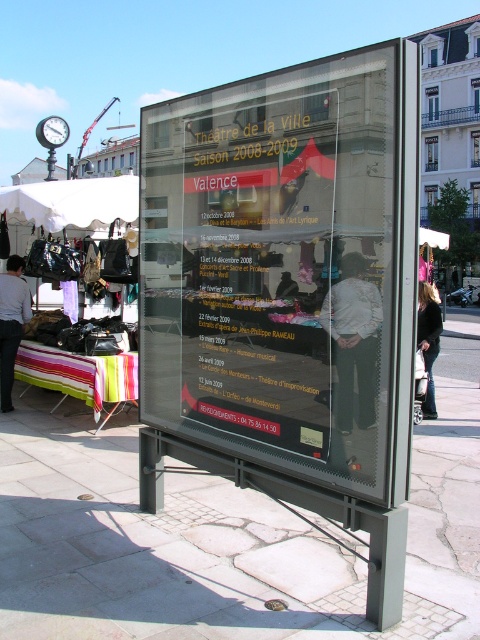
Question: Which point is closer to the camera?

Choices:
 (A) white fabric canopy at upper left
 (B) white cotton shirt at center
 (C) black leather jacket at lower right
 (D) matte black shirt at center

Answer: (B)

Question: Can you confirm if white cotton shirt at center is positioned below black leather jacket at lower right?

Choices:
 (A) no
 (B) yes

Answer: (A)

Question: Estimate the real-world distances between objects in this image. Which object is farther from the white fabric canopy at upper left?

Choices:
 (A) transparent glass bus stop at center
 (B) black leather jacket at lower right
 (C) white cotton shirt at center

Answer: (C)

Question: Which of these objects is positioned closest to the matte black shirt at center?

Choices:
 (A) black leather jacket at lower right
 (B) white cotton shirt at center

Answer: (B)

Question: Can you confirm if white cotton shirt at center is bigger than matte black shirt at center?

Choices:
 (A) yes
 (B) no

Answer: (A)

Question: Is white fabric canopy at upper left below light gray shirt at lower left?

Choices:
 (A) no
 (B) yes

Answer: (A)